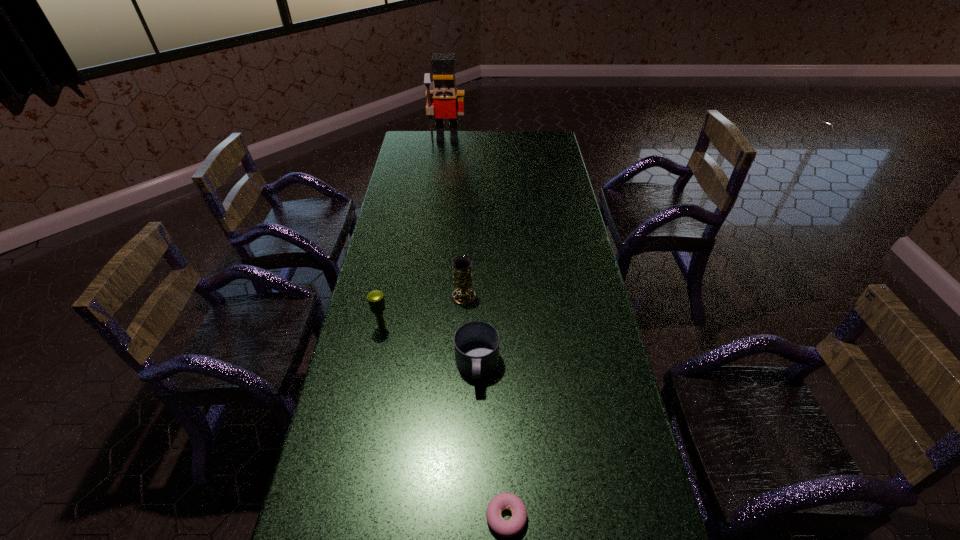
Locate an element on the screen. The image size is (960, 540). vacant area at the left edge is located at coordinates (385, 256).

Locate an element on the screen. free space at the right edge of the desktop is located at coordinates (556, 269).

The width and height of the screenshot is (960, 540). In the image, there is a desktop. What are the coordinates of `vacant space at the far left corner` in the screenshot? It's located at (418, 132).

I want to click on free space between the chalice and the fifth nearest object, so click(472, 251).

Find the location of `vacant space that is in between the third nearest object and the sunglasses`. vacant space that is in between the third nearest object and the sunglasses is located at coordinates (432, 267).

This screenshot has height=540, width=960. In order to click on free space between the sunglasses and the third shortest object in this screenshot , I will do `click(479, 286)`.

At what (x,y) coordinates should I click in order to perform the action: click on free space between the third farthest object and the sunglasses. Please return your answer as a coordinate pair (x, y). Looking at the image, I should click on (472, 251).

In order to click on vacant space that's between the chalice and the tallest object in this screenshot , I will do point(455,218).

Identify the location of vacant region between the nearest object and the chalice. (485, 407).

Identify the location of vacant area between the tallest object and the third nearest object. (415, 234).